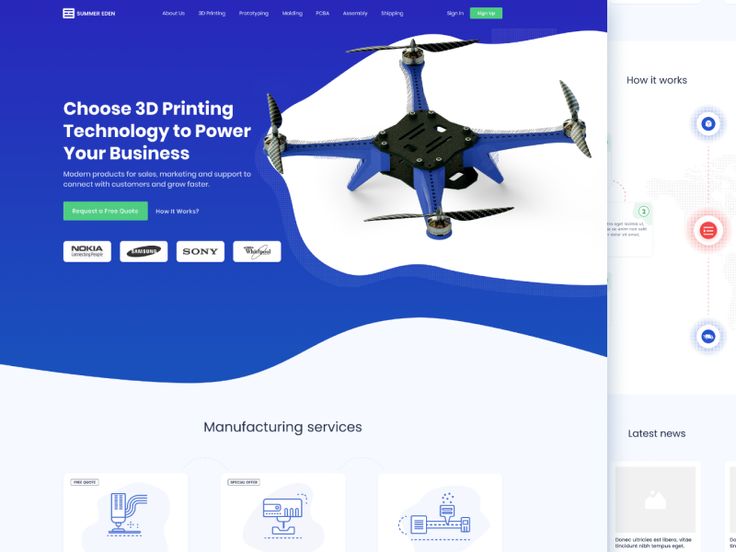
I want to click on monitor pic, so click(x=279, y=509).